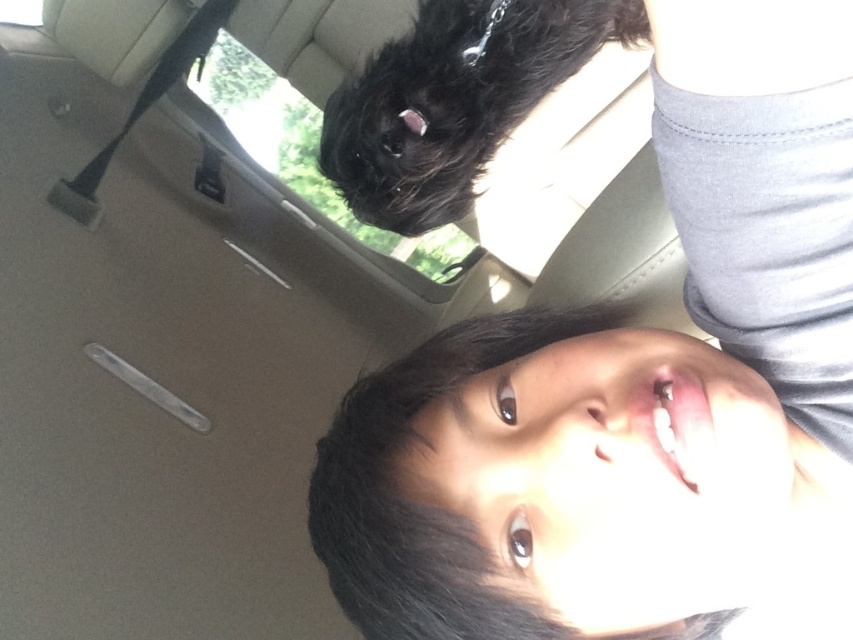
The width and height of the screenshot is (853, 640). What do you see at coordinates (605, 340) in the screenshot?
I see `smooth skin face at center` at bounding box center [605, 340].

Does smooth skin face at center have a smaller size compared to transparent glass window at upper center?

Indeed, smooth skin face at center has a smaller size compared to transparent glass window at upper center.

Is point (550, 20) closer to viewer compared to point (407, 260)?

Yes, point (550, 20) is closer to viewer.

The image size is (853, 640). I want to click on smooth skin face at center, so click(605, 340).